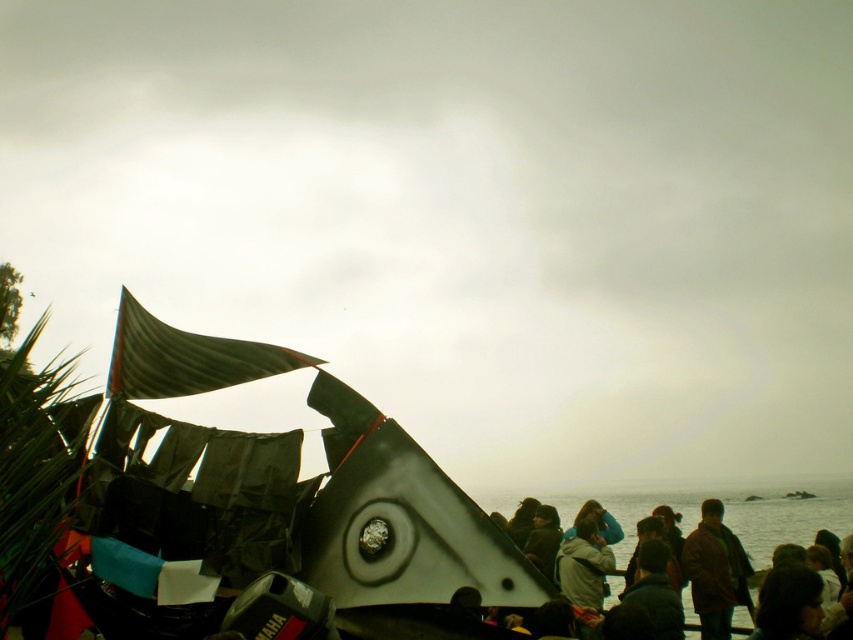
Question: Which is nearer to the dark gray jacket at lower right?

Choices:
 (A) brown woolen coat at lower right
 (B) shiny metallic boat at left

Answer: (A)

Question: Is dark gray jacket at lower right bigger than brown woolen coat at lower right?

Choices:
 (A) no
 (B) yes

Answer: (B)

Question: In this image, where is shiny metallic boat at left located relative to brown woolen coat at lower right?

Choices:
 (A) left
 (B) right

Answer: (A)

Question: Which of the following is the farthest from the observer?

Choices:
 (A) brown woolen coat at lower right
 (B) dark gray jacket at lower right
 (C) shiny metallic boat at left

Answer: (B)

Question: Which of the following is the closest to the observer?

Choices:
 (A) brown woolen coat at lower right
 (B) shiny metallic boat at left

Answer: (B)

Question: Does dark gray jacket at lower right come in front of brown woolen coat at lower right?

Choices:
 (A) no
 (B) yes

Answer: (A)